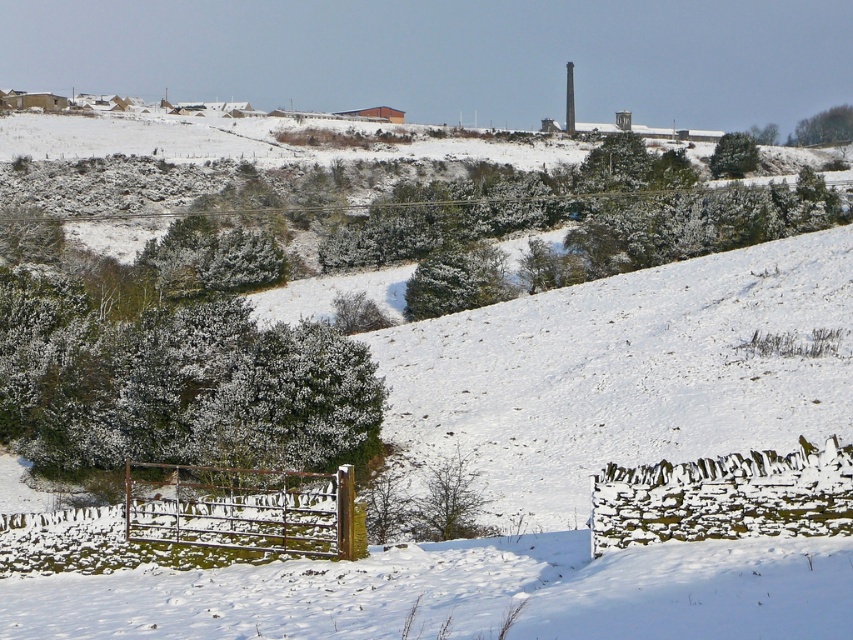
Question: Can you confirm if green textured bush at left is wider than brown metal fence at lower center?

Choices:
 (A) yes
 (B) no

Answer: (A)

Question: Is green textured bush at left to the right of brown metal fence at lower center from the viewer's perspective?

Choices:
 (A) no
 (B) yes

Answer: (A)

Question: Which object appears farthest from the camera in this image?

Choices:
 (A) brown metal fence at lower center
 (B) green leafy tree at upper right

Answer: (B)

Question: Can you confirm if green textured bush at left is positioned to the left of green matte tree at upper right?

Choices:
 (A) no
 (B) yes

Answer: (B)

Question: Which point appears farthest from the camera in this image?

Choices:
 (A) (717, 161)
 (B) (341, 337)
 (C) (788, 140)
 (D) (247, 536)

Answer: (C)

Question: Which object appears closest to the camera in this image?

Choices:
 (A) green textured bush at left
 (B) green matte tree at upper right

Answer: (A)